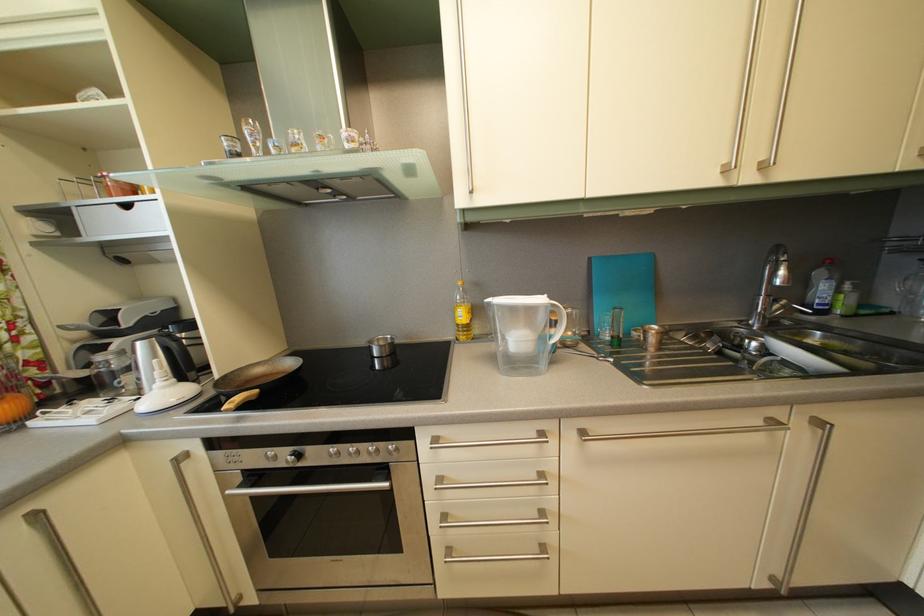
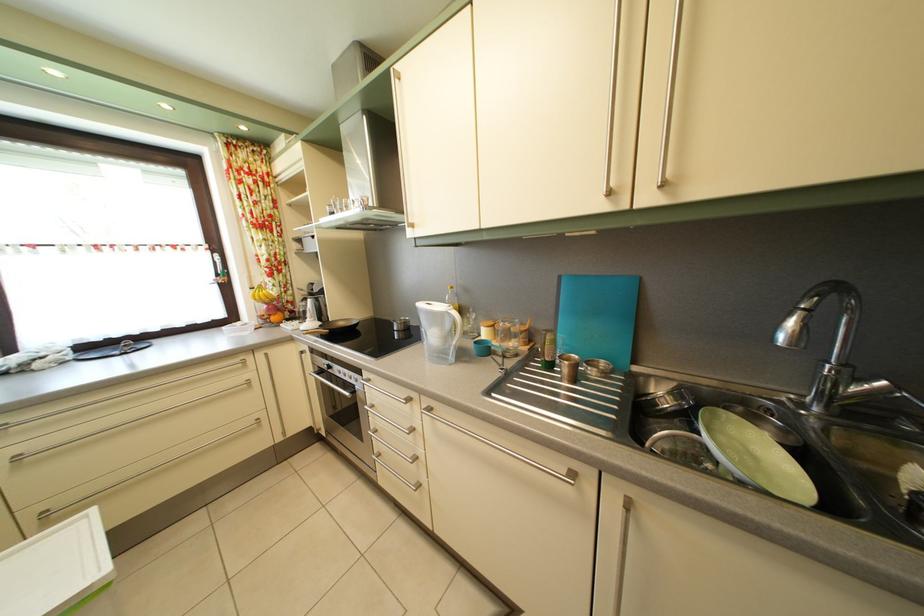
The point at (99, 411) is marked in the first image. Where is the corresponding point in the second image?

(305, 330)